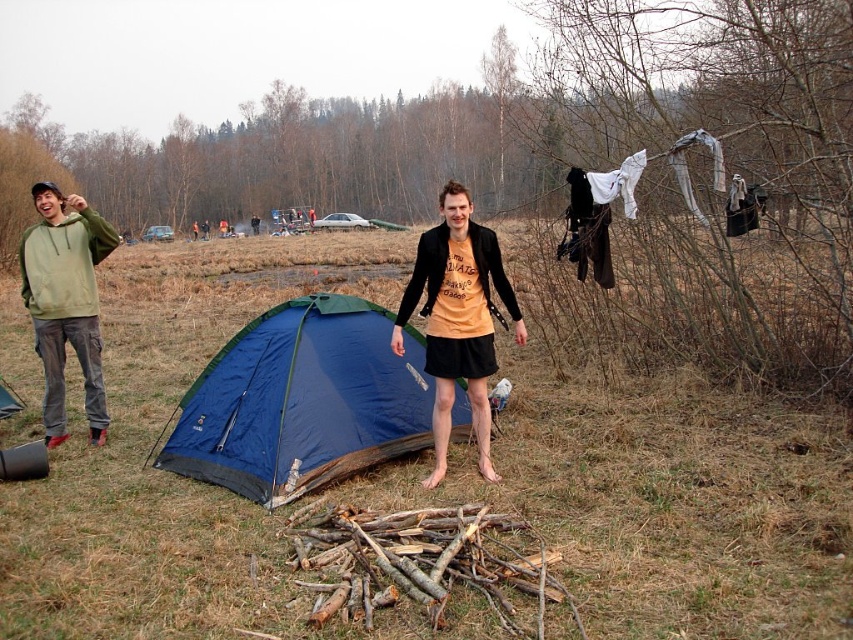
Does matte green hoodie at left have a lesser width compared to orange matte t-shirt at center?

No, matte green hoodie at left is not thinner than orange matte t-shirt at center.

Can you confirm if matte green hoodie at left is positioned below orange matte t-shirt at center?

Yes.

The height and width of the screenshot is (640, 853). I want to click on matte green hoodie at left, so click(305, 401).

Does point (341, 461) come closer to viewer compared to point (80, 252)?

Yes, it is in front of point (80, 252).

I want to click on matte green hoodie at left, so click(305, 401).

Does orange matte t-shirt at center appear over green fleece hoodie at left?

Correct, orange matte t-shirt at center is located above green fleece hoodie at left.

Is orange matte t-shirt at center positioned before green fleece hoodie at left?

Yes, orange matte t-shirt at center is closer to the viewer.

Is point (473, 406) more distant than point (96, 333)?

No, it is in front of (96, 333).

Image resolution: width=853 pixels, height=640 pixels. Find the location of `orange matte t-shirt at center`. orange matte t-shirt at center is located at coordinates (457, 317).